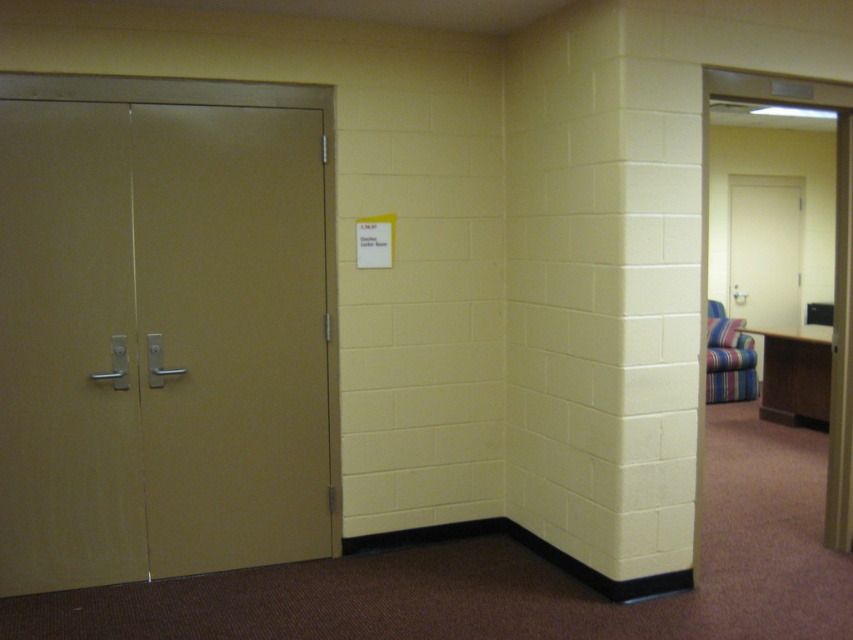
You are standing in the hallway and need to sit down. There is a metallic gold elevator at left and a striped fabric armchair at right. Which object can you sit on?

The striped fabric armchair at right is the object you can sit on because the metallic gold elevator at left is taller and likely not designed for sitting.

You are standing in the hallway and need to find the elevator. There is a point at coordinates (164, 328). Is this point on the metallic gold elevator at left or the double door on the left side?

The point at coordinates (164, 328) is on the metallic gold elevator at left, so it is not on the double door on the left side.

You are standing in the hallway and need to move the striped fabric armchair at right closer to the metallic gold elevator at left. Can you position the armchair so that it touches the elevator without overlapping them?

The metallic gold elevator at left is wider than the striped fabric armchair at right. Since the elevator is wider, you can place the armchair next to it so that their edges align, allowing them to touch without overlapping.